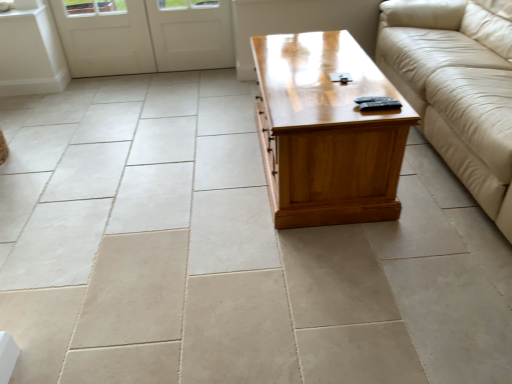
Find the location of a particular element. free location in front of white matte door at upper left is located at coordinates (144, 92).